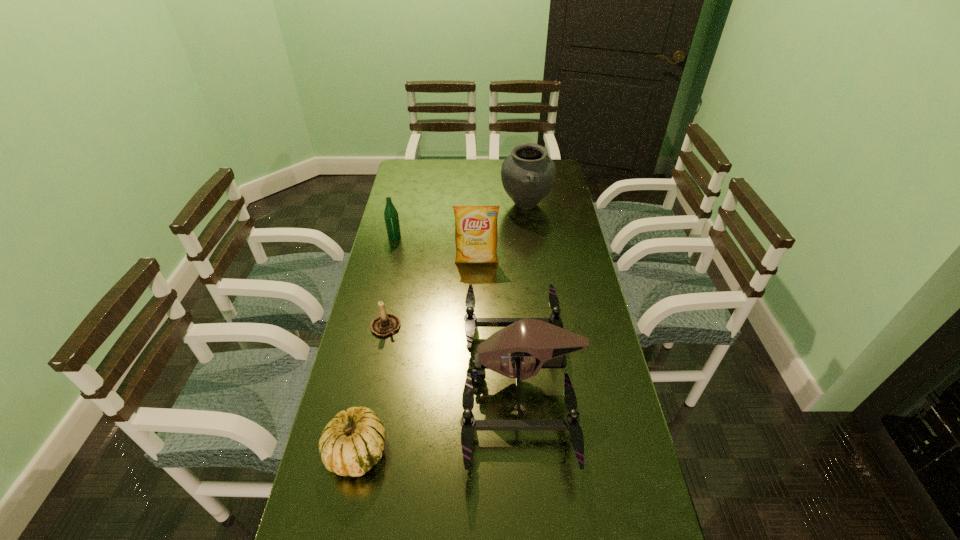
You are a GUI agent. You are given a task and a screenshot of the screen. Output one action in this format:
    pyautogui.click(x=<x>, y=<y>)
    Task: Click on the free space that is in between the third shortest object and the gourd
    
    Given the screenshot: What is the action you would take?
    pyautogui.click(x=375, y=344)

Locate which object is the fifth closest to the fourth tallest object. Please provide its 2D coordinates. Your answer should be formatted as a tuple, i.e. [(x, y)], where the tuple contains the x and y coordinates of a point satisfying the conditions above.

[(351, 443)]

The width and height of the screenshot is (960, 540). Find the location of `the third closest object relative to the bottle`. the third closest object relative to the bottle is located at coordinates [x=528, y=174].

The height and width of the screenshot is (540, 960). I want to click on free space that satisfies the following two spatial constraints: 1. on the front-facing side of the drone; 2. on the front side of the gourd, so click(x=527, y=451).

Where is `vacant space that satisfies the following two spatial constraints: 1. on the front side of the second farthest object; 2. on the right side of the gourd`? vacant space that satisfies the following two spatial constraints: 1. on the front side of the second farthest object; 2. on the right side of the gourd is located at coordinates (346, 451).